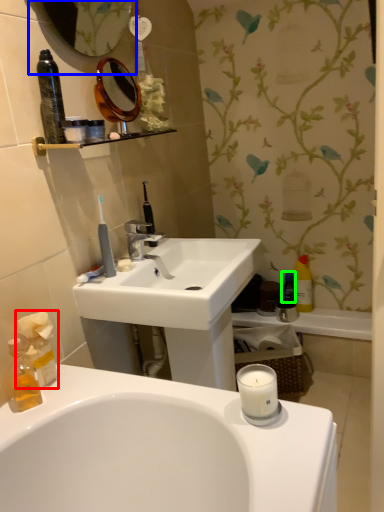
Question: Based on their relative distances, which object is farther from tissue (highlighted by a red box)? Choose from mirror (highlighted by a blue box) and mouthwash (highlighted by a green box).

Choices:
 (A) mirror
 (B) mouthwash

Answer: (B)